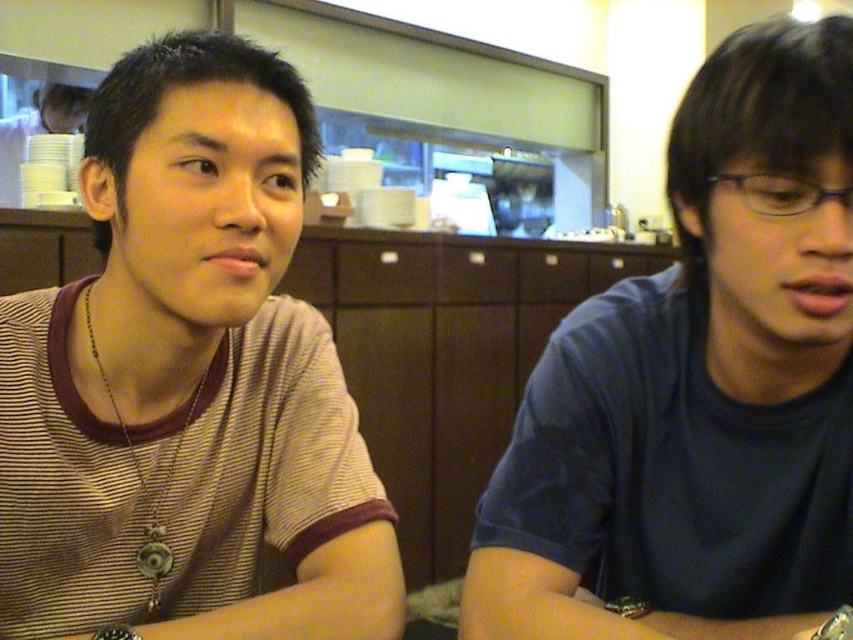
Question: Which point is farther from the camera taking this photo?

Choices:
 (A) (846, 330)
 (B) (190, 250)

Answer: (B)

Question: In this image, where is brown striped shirt at left located relative to blue matte shirt at right?

Choices:
 (A) below
 (B) above

Answer: (B)

Question: Can you confirm if brown striped shirt at left is bigger than blue matte shirt at right?

Choices:
 (A) no
 (B) yes

Answer: (A)

Question: Is brown striped shirt at left positioned at the back of blue matte shirt at right?

Choices:
 (A) no
 (B) yes

Answer: (B)

Question: Which object appears farthest from the camera in this image?

Choices:
 (A) blue matte shirt at right
 (B) brown striped shirt at left

Answer: (B)